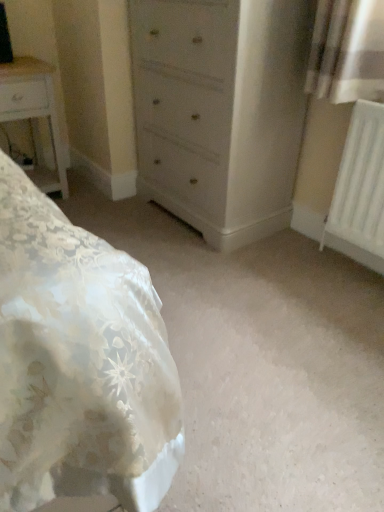
The width and height of the screenshot is (384, 512). I want to click on vacant space in between light gray wood chest of drawers at center and white plastic radiator at right, so click(x=289, y=256).